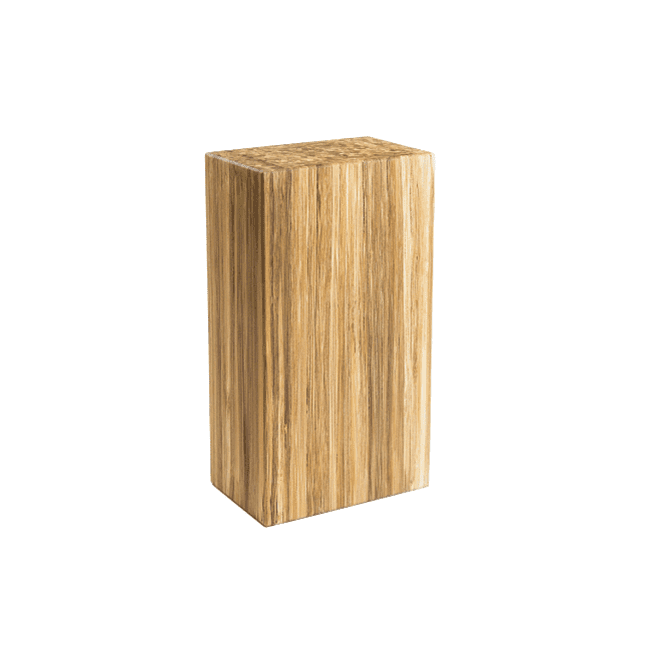
Locate an element on the screen. butcher block kitchen island is located at coordinates (315, 360).